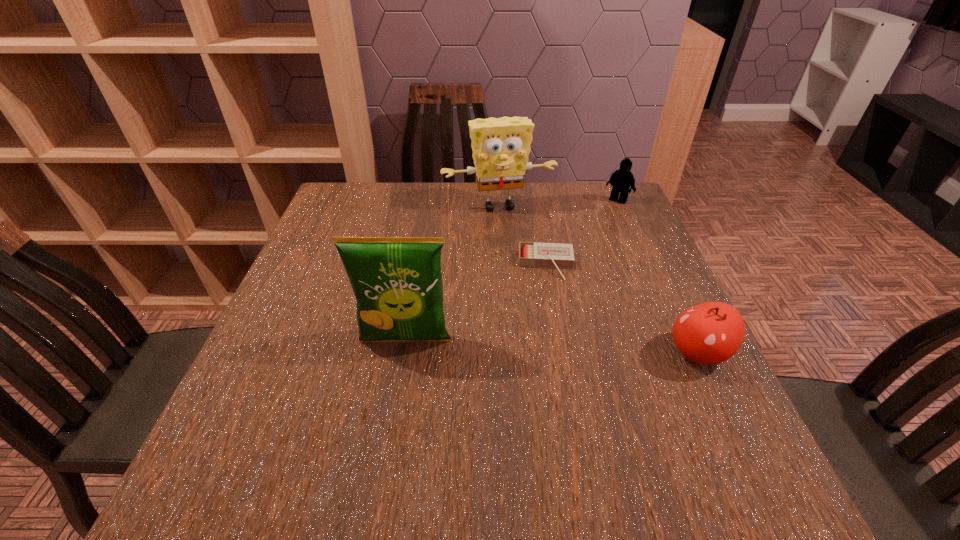
Identify the location of vacant area situated 0.150m on the face of the sponge. This screenshot has height=540, width=960. (520, 249).

You are a GUI agent. You are given a task and a screenshot of the screen. Output one action in this format:
    pyautogui.click(x=<x>, y=<y>)
    Task: Click on the vacant space located 0.290m on the striking surface of the shortest object
    This screenshot has height=540, width=960.
    Given the screenshot: What is the action you would take?
    pyautogui.click(x=554, y=382)

I want to click on free space located 0.200m on the striking surface of the shortest object, so click(x=551, y=346).

This screenshot has height=540, width=960. I want to click on vacant space positioned 0.350m on the striking surface of the shortest object, so click(555, 411).

The image size is (960, 540). Find the location of `free space located 0.080m on the face of the Lego`. free space located 0.080m on the face of the Lego is located at coordinates click(x=603, y=217).

The width and height of the screenshot is (960, 540). In order to click on blank space located 0.050m on the face of the Lego in this screenshot , I will do `click(607, 212)`.

Locate an element on the screen. This screenshot has width=960, height=540. free space located on the face of the Lego is located at coordinates (595, 227).

I want to click on sponge present at the far edge, so click(x=501, y=146).

Locate an element on the screen. The image size is (960, 540). Lego located in the far edge section of the desktop is located at coordinates (622, 179).

Identify the location of apple located in the right edge section of the desktop. The height and width of the screenshot is (540, 960). (709, 333).